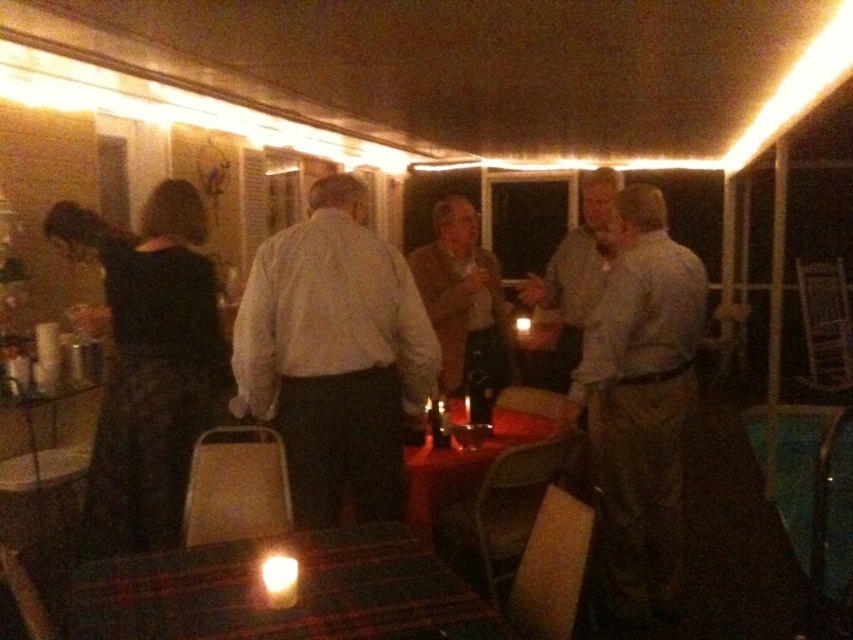
Question: Can you confirm if white matte shirt at center is thinner than light brown shirt at center?

Choices:
 (A) yes
 (B) no

Answer: (B)

Question: Which is farther from the wooden table at center?

Choices:
 (A) plaid fabric table at center
 (B) light gray shirt at right

Answer: (A)

Question: Based on their relative distances, which object is farther from the white matte shirt at center?

Choices:
 (A) light gray shirt at right
 (B) brown leather jacket at center
 (C) wooden table at center

Answer: (A)

Question: Is plaid fabric table at center further to the viewer compared to brown leather jacket at center?

Choices:
 (A) yes
 (B) no

Answer: (B)

Question: Is white matte shirt at center to the right of brown leather jacket at center from the viewer's perspective?

Choices:
 (A) yes
 (B) no

Answer: (B)

Question: Estimate the real-world distances between objects in this image. Which object is closer to the plaid fabric table at center?

Choices:
 (A) white matte shirt at center
 (B) light gray shirt at right
 (C) light brown shirt at center
 (D) brown leather jacket at center

Answer: (A)